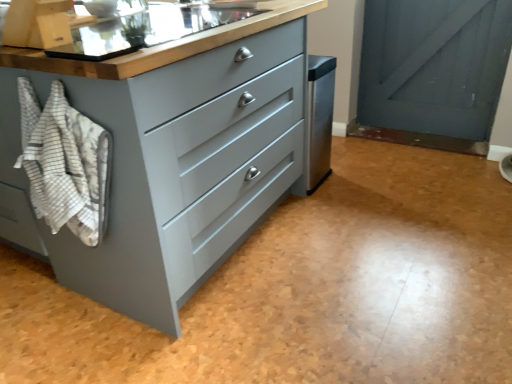
You are a GUI agent. You are given a task and a screenshot of the screen. Output one action in this format:
    pyautogui.click(x=<x>, y=<y>)
    Task: Click on the free spot in front of matte gray chest of drawers at center
    
    Given the screenshot: What is the action you would take?
    pyautogui.click(x=232, y=329)